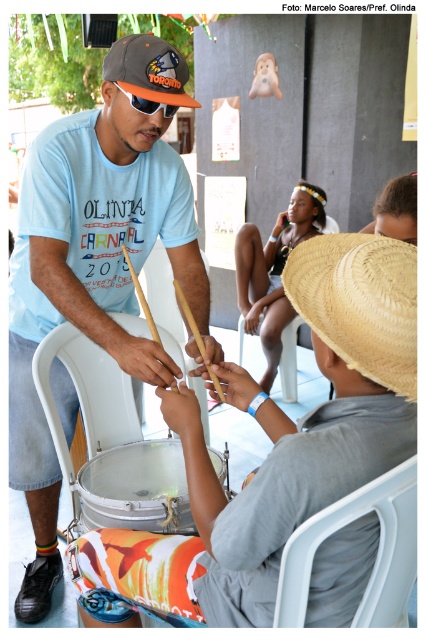
Question: Can you confirm if natural straw hat at center is positioned above straw hat at center?

Choices:
 (A) no
 (B) yes

Answer: (A)

Question: Is silver metallic drum at lower center below straw hat at center?

Choices:
 (A) no
 (B) yes

Answer: (B)

Question: Which of these objects is positioned closest to the straw hat at center?

Choices:
 (A) light brown skin at center
 (B) matte blue t-shirt at center
 (C) silver metallic drum at lower center

Answer: (B)

Question: Does matte blue t-shirt at center have a larger size compared to silver metallic drum at lower center?

Choices:
 (A) no
 (B) yes

Answer: (B)

Question: Considering the real-world distances, which object is closest to the natural straw hat at center?

Choices:
 (A) straw hat at center
 (B) matte blue t-shirt at center
 (C) light brown skin at center

Answer: (A)

Question: Which object is the closest to the light brown skin at center?

Choices:
 (A) matte blue t-shirt at center
 (B) natural straw hat at center
 (C) silver metallic drum at lower center
 (D) straw hat at center

Answer: (A)